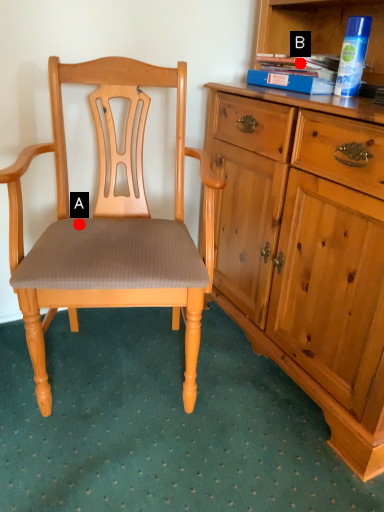
Question: Two points are circled on the image, labeled by A and B beside each circle. Which point is farther from the camera taking this photo?

Choices:
 (A) A is further
 (B) B is further

Answer: (B)